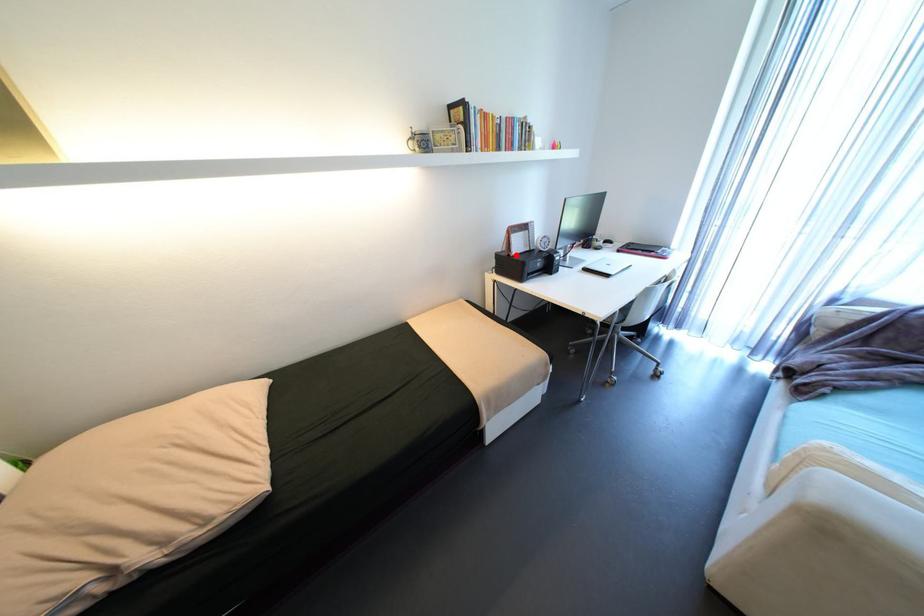
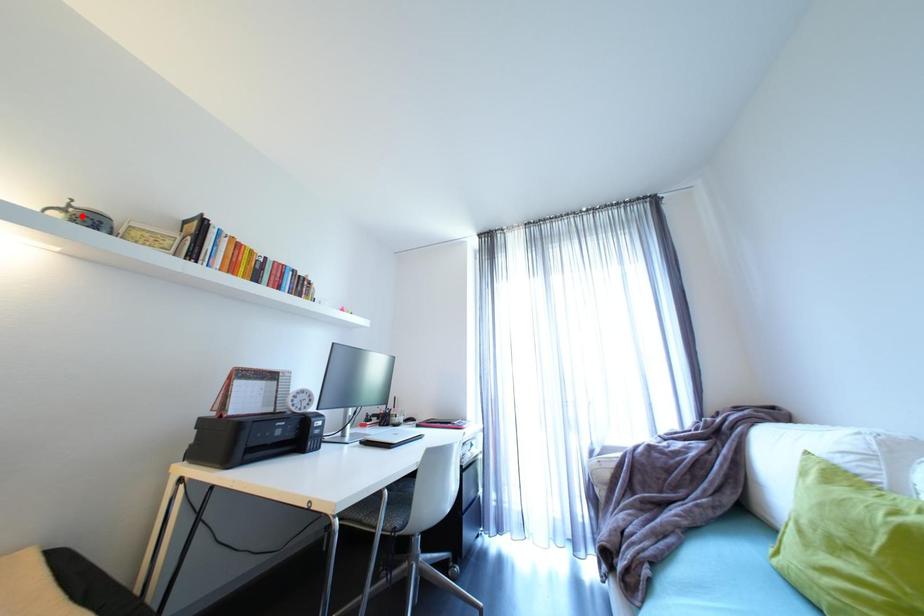
Based on the photo, I am providing you with two images of the same scene from different viewpoints. A red point is marked on the first image and another point is marked on the second image. Are the points marked in image1 and image2 representing the same 3D position?

No